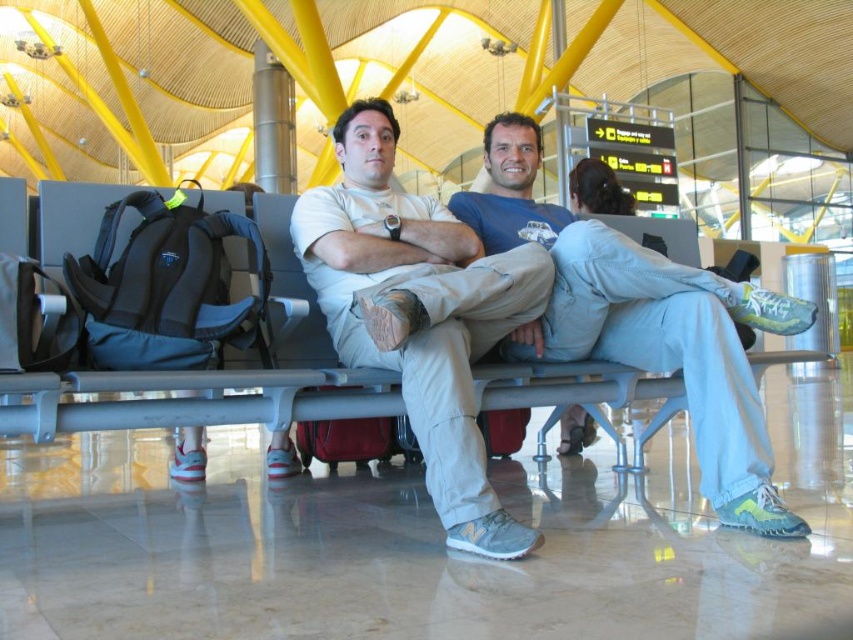
Question: Can you confirm if light beige cotton pants at center is wider than light blue denim jeans at center?

Choices:
 (A) no
 (B) yes

Answer: (A)

Question: Which is nearer to the light blue denim jeans at center?

Choices:
 (A) metallic gray bench at center
 (B) maroon fabric suitcase at center

Answer: (A)

Question: Can you confirm if light beige cotton pants at center is positioned above metallic gray bench at center?

Choices:
 (A) no
 (B) yes

Answer: (B)

Question: Is light beige cotton pants at center smaller than maroon fabric suitcase at center?

Choices:
 (A) no
 (B) yes

Answer: (A)

Question: Which of the following is the farthest from the observer?

Choices:
 (A) metallic gray bench at center
 (B) maroon fabric suitcase at center
 (C) light beige cotton pants at center
 (D) light blue denim jeans at center

Answer: (B)

Question: Estimate the real-world distances between objects in this image. Which object is closer to the light blue denim jeans at center?

Choices:
 (A) light beige cotton pants at center
 (B) metallic gray bench at center
 (C) maroon fabric suitcase at center

Answer: (A)